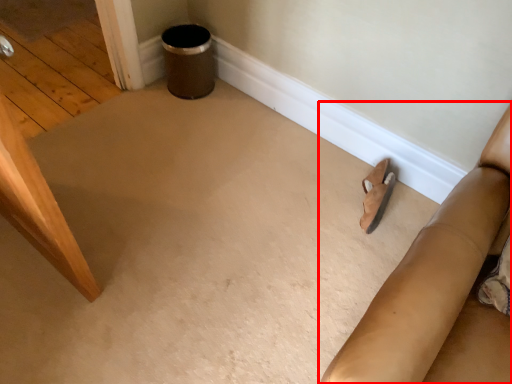
Question: From the image, what is the correct spatial relationship of furniture (annotated by the red box) in relation to footwear?

Choices:
 (A) right
 (B) left

Answer: (A)